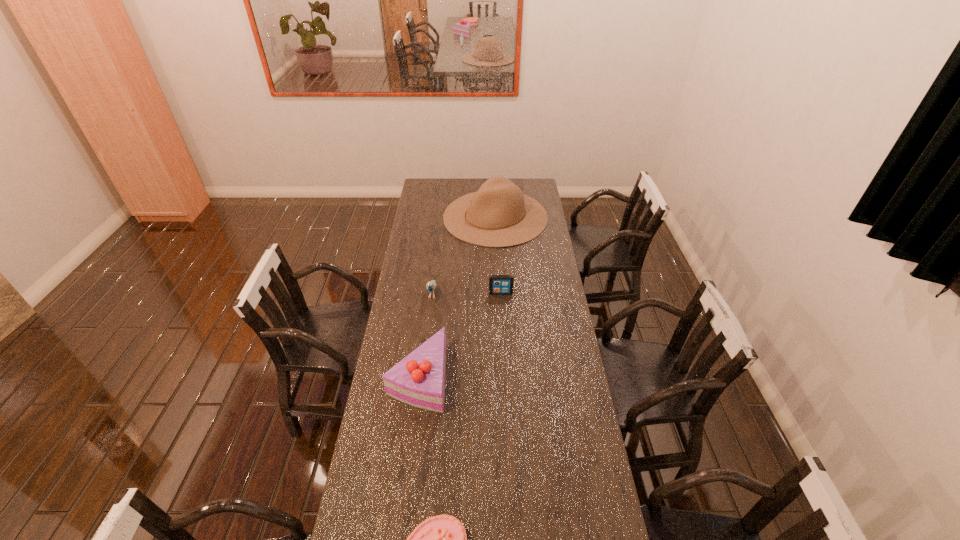
Locate an element on the screen. This screenshot has width=960, height=540. the tallest object is located at coordinates (498, 215).

I want to click on sombrero, so coord(498,215).

Find the location of a particular element. the fourth farthest object is located at coordinates (418, 380).

You are a GUI agent. You are given a task and a screenshot of the screen. Output one action in this format:
    pyautogui.click(x=<x>, y=<y>)
    Task: Click on the second tallest object
    This screenshot has width=960, height=540.
    Given the screenshot: What is the action you would take?
    point(418,380)

Where is `bird`? This screenshot has height=540, width=960. bird is located at coordinates (431, 286).

Find the location of a particular element. This screenshot has width=960, height=540. the fourth tallest object is located at coordinates (498, 284).

You are a GUI agent. You are given a task and a screenshot of the screen. Output one action in this format:
    pyautogui.click(x=<x>, y=<y>)
    Task: Click on the free space located 0.250m on the front of the farthest object
    The width and height of the screenshot is (960, 540).
    Given the screenshot: What is the action you would take?
    pyautogui.click(x=498, y=280)

At what (x,y) coordinates should I click in order to perform the action: click on free region located on the right of the taller cake. Please return your answer as a coordinate pair (x, y). The image size is (960, 540). Looking at the image, I should click on (478, 377).

Find the location of `vacant space located at the face of the third shortest object`. vacant space located at the face of the third shortest object is located at coordinates (428, 326).

You are a GUI agent. You are given a task and a screenshot of the screen. Output one action in this format:
    pyautogui.click(x=<x>, y=<y>)
    Task: Click on the free region located 0.390m on the front screen of the iPod
    The width and height of the screenshot is (960, 540).
    Given the screenshot: What is the action you would take?
    pyautogui.click(x=505, y=364)